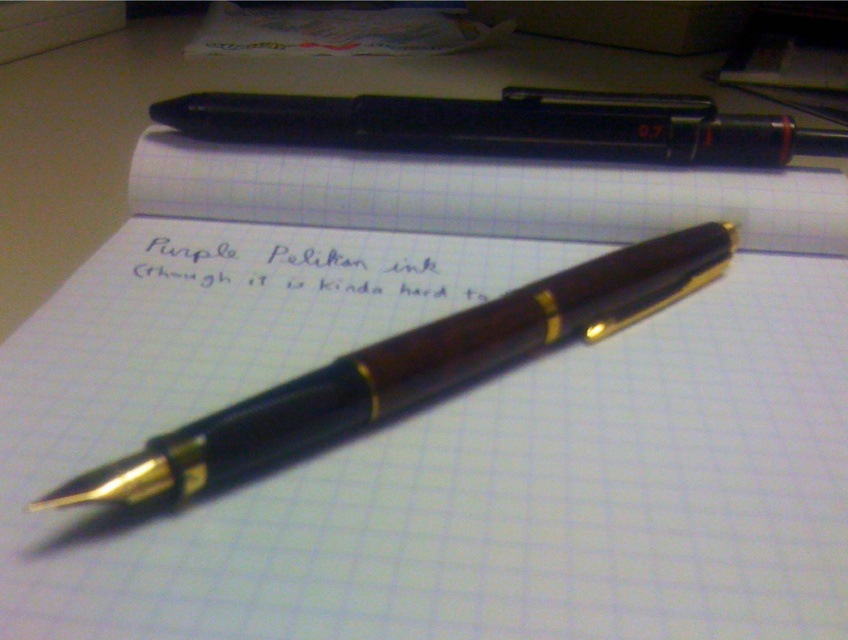
Question: Does matte black pen at upper center have a lesser width compared to purple pelikan ink at center?

Choices:
 (A) yes
 (B) no

Answer: (B)

Question: Among these objects, which one is farthest from the camera?

Choices:
 (A) matte black pen at upper center
 (B) purple pelikan ink at center
 (C) wooden pen at center

Answer: (A)

Question: Does wooden pen at center have a greater width compared to purple pelikan ink at center?

Choices:
 (A) yes
 (B) no

Answer: (A)

Question: Estimate the real-world distances between objects in this image. Which object is farther from the matte black pen at upper center?

Choices:
 (A) purple pelikan ink at center
 (B) wooden pen at center

Answer: (B)

Question: Is wooden pen at center closer to the viewer compared to matte black pen at upper center?

Choices:
 (A) yes
 (B) no

Answer: (A)

Question: Which object appears closest to the camera in this image?

Choices:
 (A) matte black pen at upper center
 (B) wooden pen at center
 (C) purple pelikan ink at center

Answer: (B)